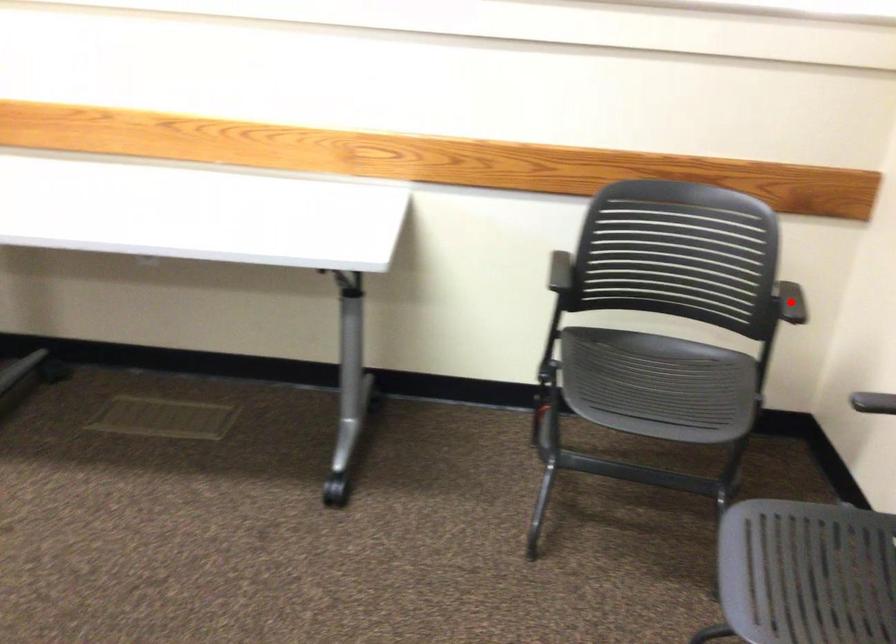
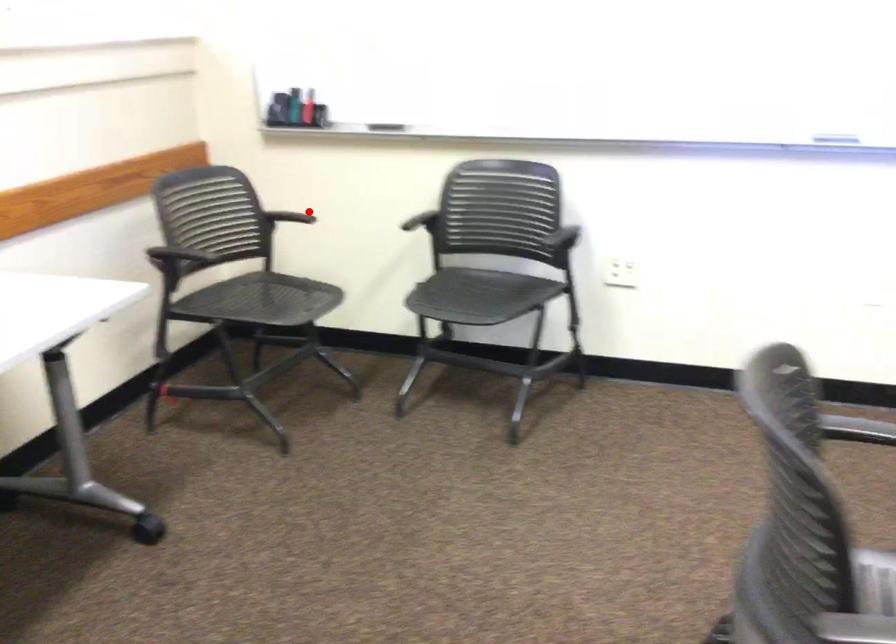
I am providing you with two images of the same scene from different viewpoints. A red point is marked on the first image and another point is marked on the second image. Are the points marked in image1 and image2 representing the same 3D position?

Yes